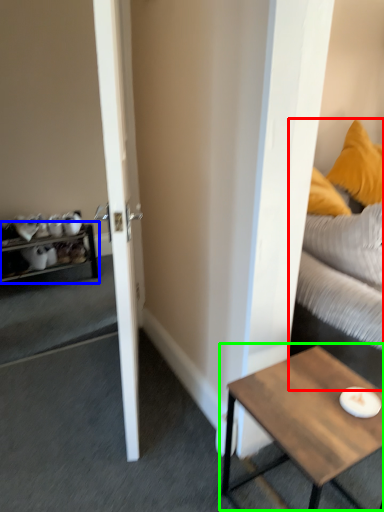
Question: Considering the real-world distances, which object is closest to studio couch (highlighted by a red box)? shelf (highlighted by a blue box) or coffee table (highlighted by a green box).

Choices:
 (A) shelf
 (B) coffee table

Answer: (B)